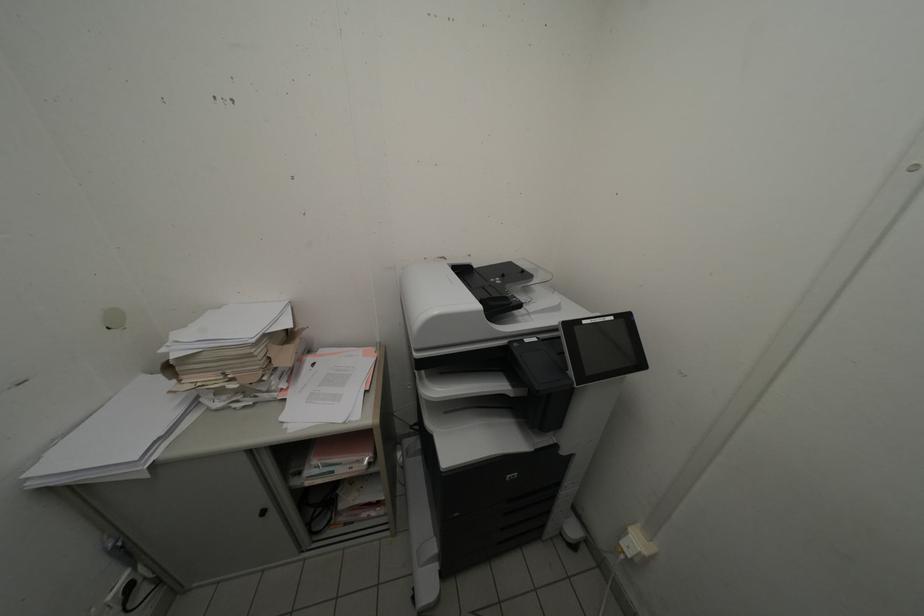
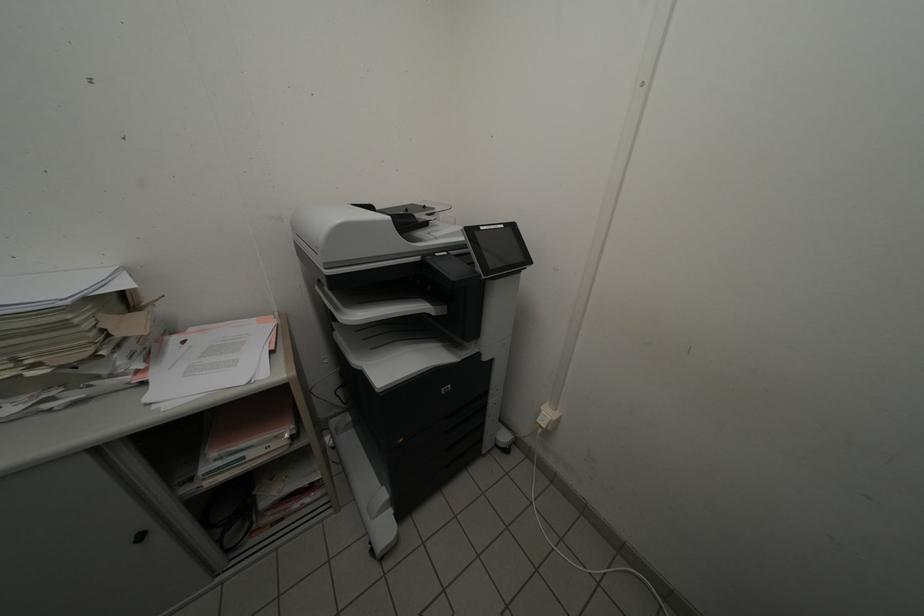
In the second image, find the point that corresponds to [592,325] in the first image.

(490, 230)